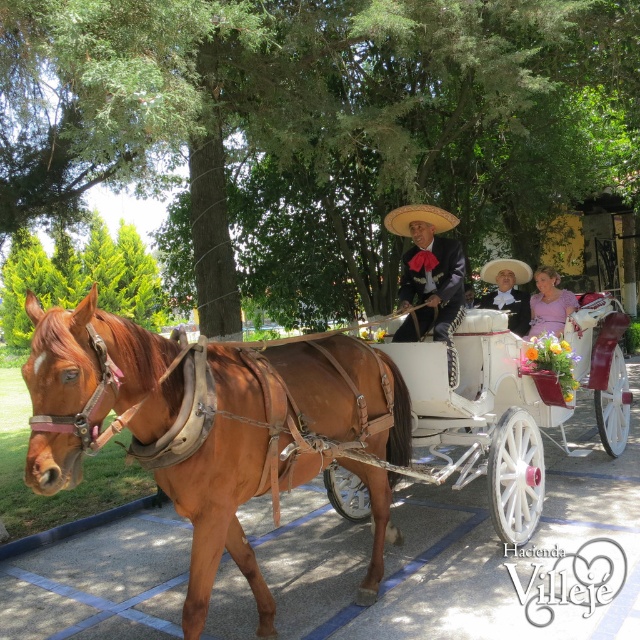
You are a photographer planning to capture a wide shot of the scene. The camera you are using has a maximum width capacity of 1.8 meters. Given that the brown leather horse at left and the matte black suit at center are both in the frame, can you fit both subjects within the camera frame without cropping?

The brown leather horse at left is wider than the matte black suit at center. Since the camera can only capture up to 1.8 meters in width, and the horse is wider than the suit, it depends on their combined width. However, the description only states the horse is wider than the suit but does not provide exact measurements. Without specific dimensions, it is impossible to determine if both will fit within the camera frame.